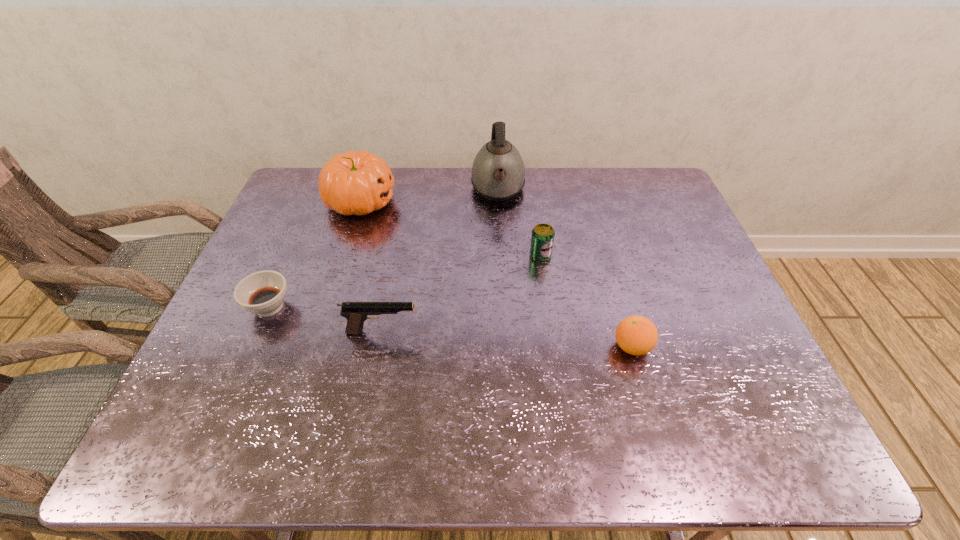
Find the location of a particular element. the tallest object is located at coordinates (498, 172).

Identify the location of pumpkin. (355, 183).

Image resolution: width=960 pixels, height=540 pixels. What are the coordinates of `pistol` in the screenshot? It's located at (356, 313).

I want to click on the fourth nearest object, so click(542, 239).

At what (x,y) coordinates should I click in order to perform the action: click on orange. Please return your answer as a coordinate pair (x, y). The height and width of the screenshot is (540, 960). Looking at the image, I should click on (636, 335).

The width and height of the screenshot is (960, 540). I want to click on the shortest object, so click(x=263, y=293).

At what (x,y) coordinates should I click in order to perform the action: click on soup bowl. Please return your answer as a coordinate pair (x, y). The image size is (960, 540). Looking at the image, I should click on (263, 293).

Where is `free spot located at the spout of the tallest object`? Image resolution: width=960 pixels, height=540 pixels. free spot located at the spout of the tallest object is located at coordinates (502, 269).

Image resolution: width=960 pixels, height=540 pixels. I want to click on vacant area located 0.050m on the carved face of the second tallest object, so click(413, 201).

I want to click on vacant region located at the muzzle of the pistol, so click(x=443, y=332).